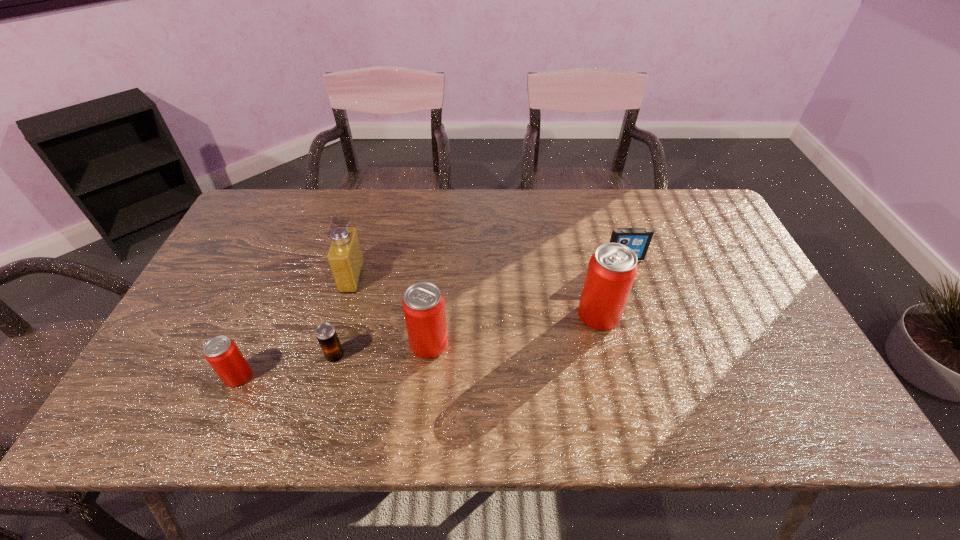
Locate an element on the screen. Image resolution: width=960 pixels, height=540 pixels. free space that satisfies the following two spatial constraints: 1. on the front-facing side of the fifth nearest object; 2. on the left side of the fourth object from left to right is located at coordinates (333, 344).

The height and width of the screenshot is (540, 960). What are the coordinates of `vacant position in the image that satisfies the following two spatial constraints: 1. on the front screen of the farthest object; 2. on the front-facing side of the perfume` in the screenshot? It's located at (631, 278).